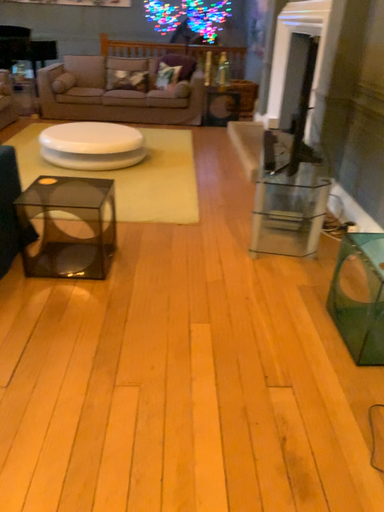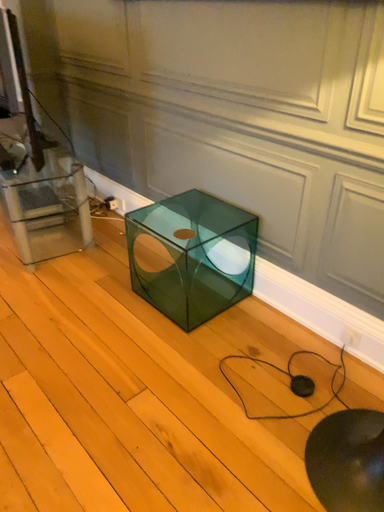
Question: Which way did the camera rotate in the video?

Choices:
 (A) rotated right
 (B) rotated left

Answer: (A)